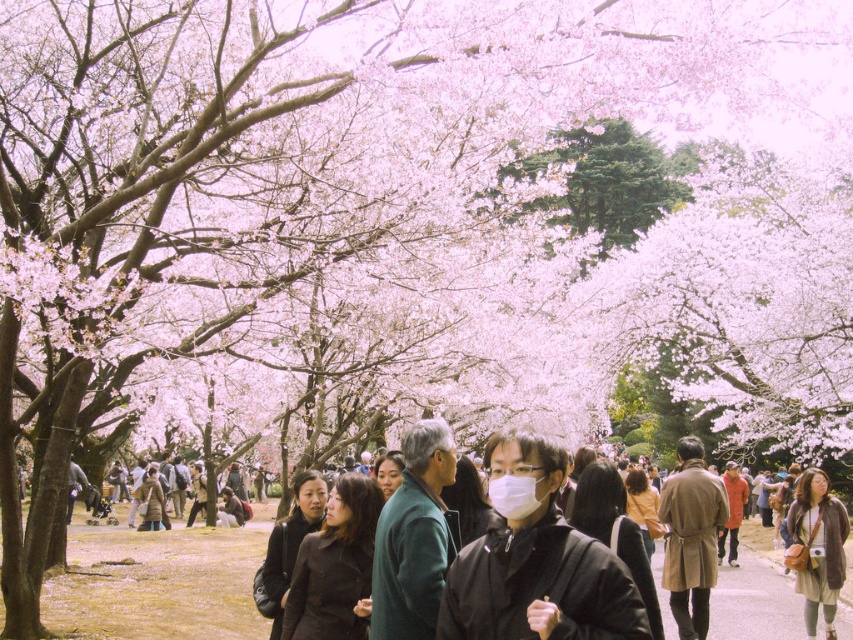
Locate an element on the screen. The image size is (853, 640). matte black jacket at center is located at coordinates (535, 561).

Is point (547, 502) in front of point (432, 612)?

Yes.

Locate an element on the screen. matte black jacket at center is located at coordinates (535, 561).

Who is more distant from viewer, (705, 588) or (804, 544)?

Point (804, 544)

Does tan leather coat at center have a larger size compared to brown leather jacket at lower right?

Yes, tan leather coat at center is bigger than brown leather jacket at lower right.

The image size is (853, 640). Find the location of `tan leather coat at center`. tan leather coat at center is located at coordinates (691, 536).

This screenshot has width=853, height=640. Find the location of `tan leather coat at center`. tan leather coat at center is located at coordinates (691, 536).

Does green matte jacket at center have a lesser height compared to tan leather coat at center?

Correct, green matte jacket at center is not as tall as tan leather coat at center.

Is green matte jacket at center to the left of tan leather coat at center from the viewer's perspective?

Indeed, green matte jacket at center is positioned on the left side of tan leather coat at center.

Identify the location of green matte jacket at center. The width and height of the screenshot is (853, 640). (415, 538).

Identify the location of green matte jacket at center. The height and width of the screenshot is (640, 853). (415, 538).